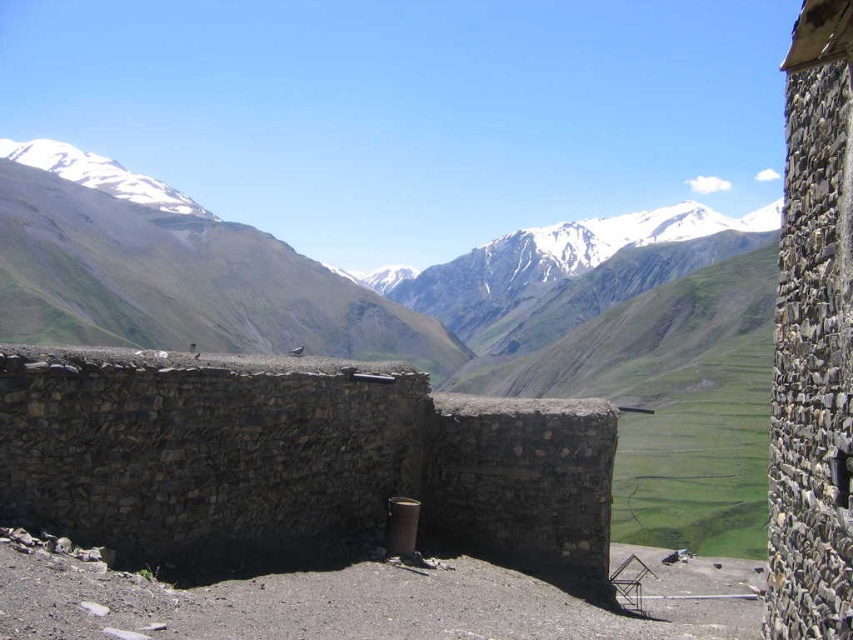
You are a hiker who wants to take a photo of the green grassy mountain at upper center. You are currently standing in front of the gray stone wall at center. Which direction should you move to get a better view of the mountain?

The gray stone wall at center is below the green grassy mountain at upper center, so you should move to the left or right of the gray stone wall at center to avoid blocking the view of the mountain.

You are standing at the base of the stone wall and want to reach the point marked at coordinates (202, 224). How far will you have to walk to get there?

The point at coordinates (202, 224) is 338.78 meters away from your current position, so you will have to walk 338.78 meters to reach it.

You are standing in the mountainous landscape and want to reach the point at coordinates point (44, 512). Given that you can walk 3 meters per minute, how many minutes will it take you to reach that point?

The distance between you and point (44, 512) is 24.30 meters. At a walking speed of 3 meters per minute, it will take you 24.30 divided by 3 equals 8.1 minutes to reach the point.